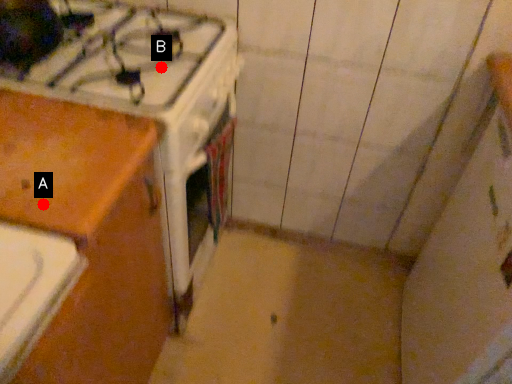
Question: Two points are circled on the image, labeled by A and B beside each circle. Which of the following is the closest to the observer?

Choices:
 (A) A is closer
 (B) B is closer

Answer: (A)